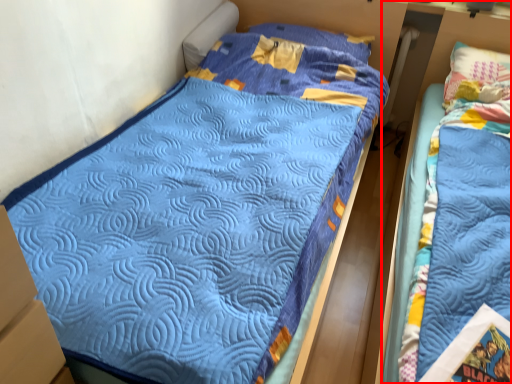
Question: From the image's perspective, where is bed (annotated by the red box) located relative to pillow?

Choices:
 (A) above
 (B) below

Answer: (B)